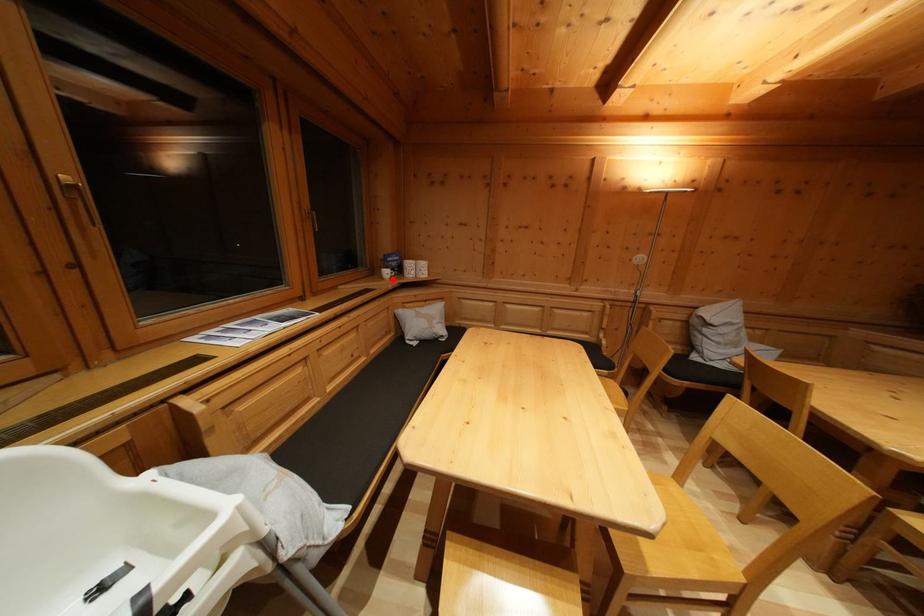
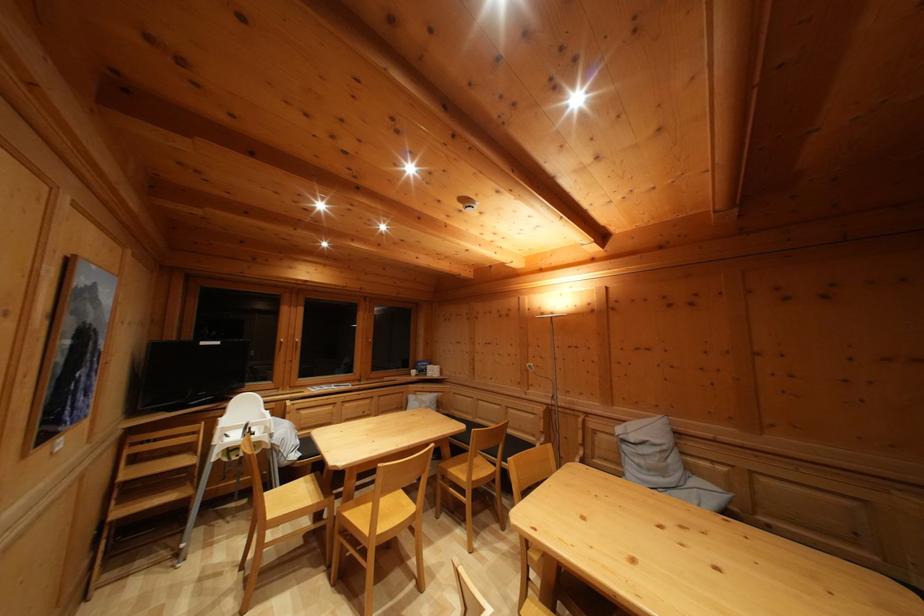
In the second image, find the point that corresponds to the highlighted location in the first image.

(419, 379)